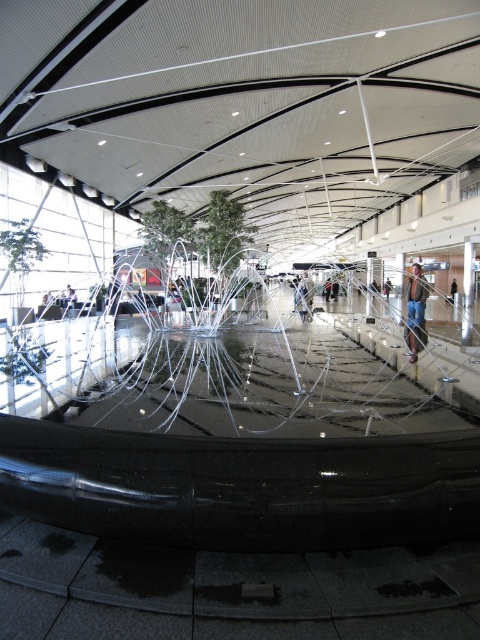
You are standing in the modern indoor space and see a blue jeans at center and a denim jacket at center. Which item is located to the left of the other?

The blue jeans at center is positioned on the left side of denim jacket at center.

You are standing in the modern public building and see the blue jeans at center and the denim jacket at center. Which item is closer to the ceiling with geometric patterns?

The denim jacket at center is closer to the ceiling with geometric patterns because it is positioned above the blue jeans at center.

You are planning to take a photo of the metallic silver person at center and the denim jacket at center. Which object should you zoom in more on to ensure both are clearly visible in the frame?

You should zoom in more on the metallic silver person at center because it is larger than the denim jacket at center, allowing both to be captured clearly without overfilling the frame.